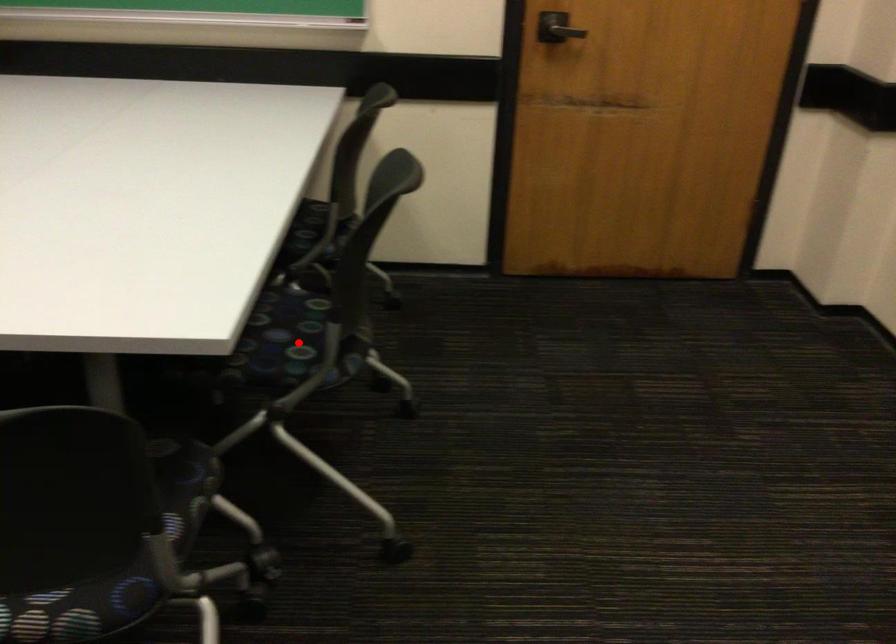
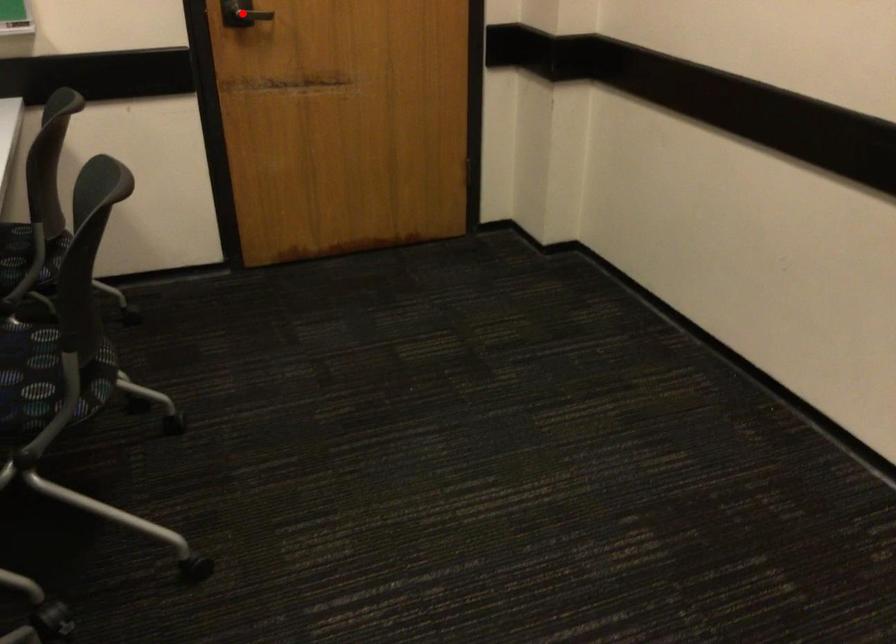
I am providing you with two images of the same scene from different viewpoints. A red point is marked on the first image and another point is marked on the second image. Does the point marked in image1 correspond to the same location as the one in image2?

No